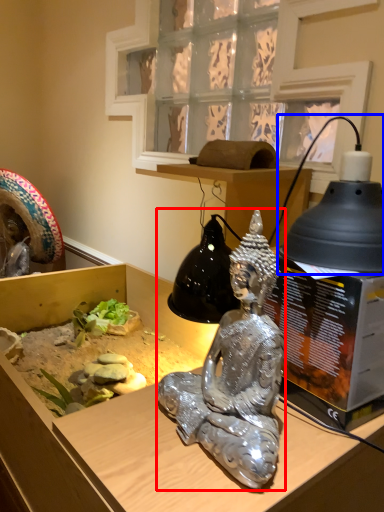
Question: Which object appears closest to the camera in this image, person (highlighted by a red box) or lamp (highlighted by a blue box)?

Choices:
 (A) person
 (B) lamp

Answer: (A)